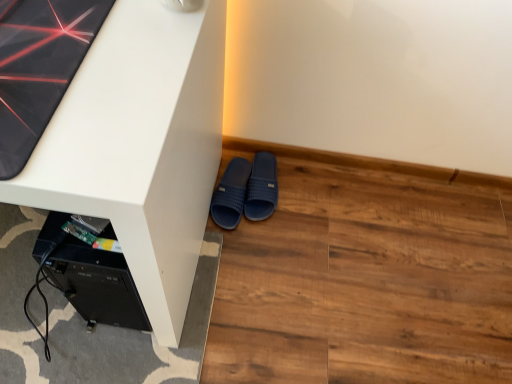
Question: In the image, is dark blue rubber slippers at lower center, which is counted as the 2th footwear, starting from the right, on the left side or the right side of white matte desk at center?

Choices:
 (A) right
 (B) left

Answer: (A)

Question: From a real-world perspective, is dark blue rubber slippers at lower center, which is counted as the 2th footwear, starting from the right, positioned above or below white matte desk at center?

Choices:
 (A) below
 (B) above

Answer: (A)

Question: Which object is positioned farthest from the dark blue rubber slippers at lower center, which ranks as the first footwear in left-to-right order?

Choices:
 (A) brown wood flooring at lower right
 (B) navy blue rubber slippers at lower center, arranged as the 1th footwear when viewed from the right
 (C) white matte desk at center

Answer: (C)

Question: Considering the real-world distances, which object is closest to the brown wood flooring at lower right?

Choices:
 (A) white matte desk at center
 (B) dark blue rubber slippers at lower center, which ranks as the first footwear in left-to-right order
 (C) navy blue rubber slippers at lower center, the 2th footwear viewed from the left

Answer: (B)